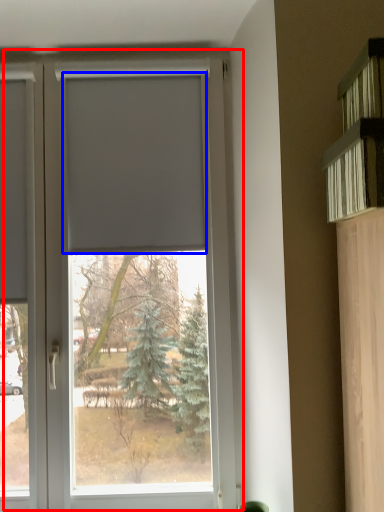
Question: Among these objects, which one is farthest to the camera, window (highlighted by a red box) or blind (highlighted by a blue box)?

Choices:
 (A) window
 (B) blind

Answer: (B)